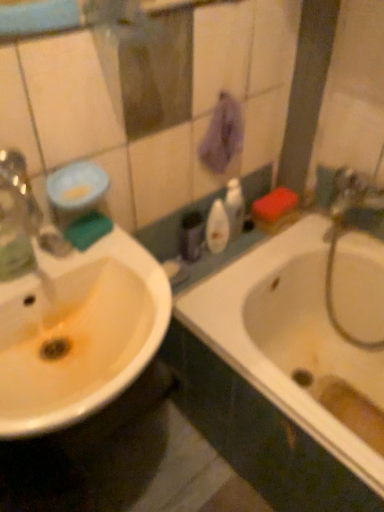
Image resolution: width=384 pixels, height=512 pixels. I want to click on vacant area that lies to the right of translucent plastic mouthwash at center, which appears as the 1th mouthwash when viewed from the back, so click(x=241, y=248).